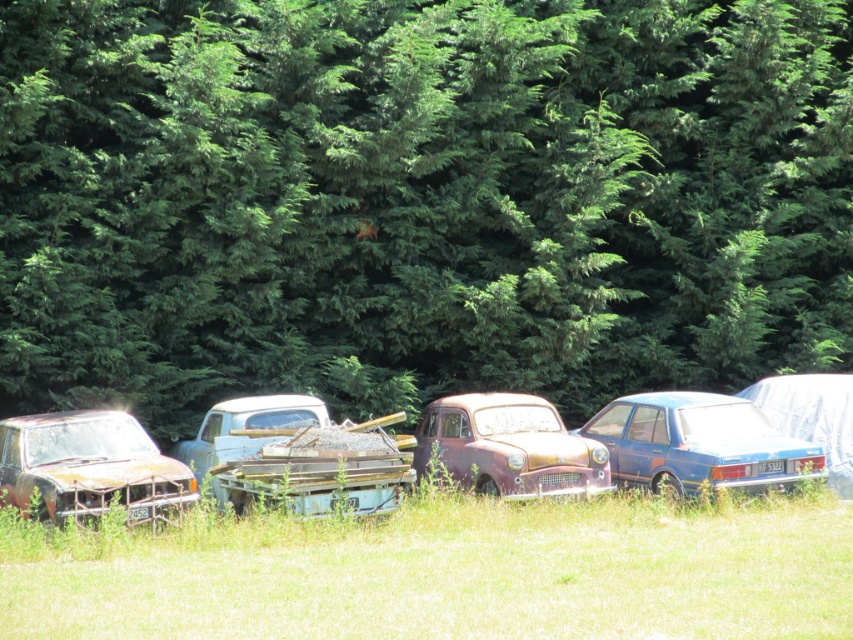
Question: Which object is closer to the camera taking this photo?

Choices:
 (A) blue matte sedan at center-right
 (B) green grass at lower center
 (C) rusty metal car at left
 (D) rusty metal truck at center

Answer: (B)

Question: Which point is closer to the camera taking this photo?

Choices:
 (A) (239, 442)
 (B) (0, 444)
 (C) (605, 595)

Answer: (C)

Question: Is rusty metal car at left to the left of rusty metal car at center from the viewer's perspective?

Choices:
 (A) yes
 (B) no

Answer: (A)

Question: Can you confirm if blue matte sedan at center-right is bigger than rusty metal car at left?

Choices:
 (A) yes
 (B) no

Answer: (A)

Question: Which of the following is the farthest from the observer?

Choices:
 (A) (680, 483)
 (B) (531, 582)

Answer: (A)

Question: Does green leafy tree at upper center appear on the left side of blue matte sedan at center-right?

Choices:
 (A) yes
 (B) no

Answer: (A)